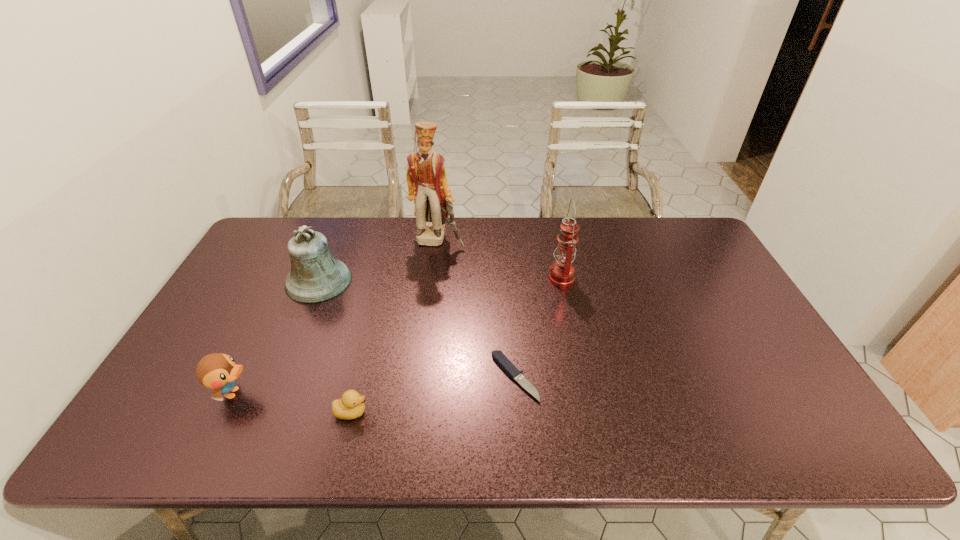
Where is `free region at the near edge of the desktop`? This screenshot has width=960, height=540. free region at the near edge of the desktop is located at coordinates (377, 432).

The image size is (960, 540). Find the location of `vacant area at the left edge`. vacant area at the left edge is located at coordinates (238, 347).

The height and width of the screenshot is (540, 960). I want to click on free space at the right edge of the desktop, so click(749, 394).

The height and width of the screenshot is (540, 960). I want to click on vacant space at the near left corner of the desktop, so click(x=165, y=419).

Locate an element on the screen. The image size is (960, 540). vacant area at the far right corner is located at coordinates (681, 242).

This screenshot has height=540, width=960. I want to click on empty space between the second object from right to left and the fourth shortest object, so click(x=417, y=329).

Find the location of a particular element. The width and height of the screenshot is (960, 540). vacant space in between the fourth object from left to right and the bell is located at coordinates tap(378, 261).

What are the coordinates of `blank region between the duck and the bell` in the screenshot? It's located at (276, 337).

Identify the location of vacant area that lies between the duckling and the farthest object. (395, 326).

Find the location of a particular element. The width and height of the screenshot is (960, 540). free point between the third object from left to right and the third object from right to left is located at coordinates (395, 326).